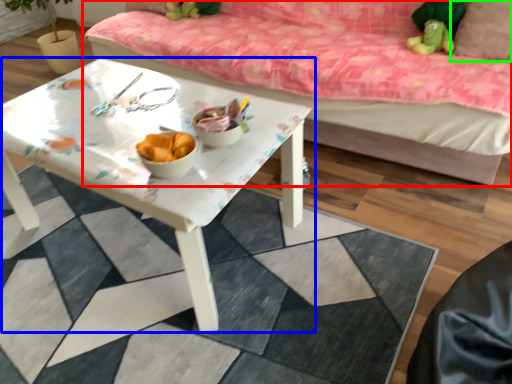
Question: Which object is positioned closest to studio couch (highlighted by a red box)? Select from table (highlighted by a blue box) and pillow (highlighted by a green box).

Choices:
 (A) table
 (B) pillow

Answer: (A)